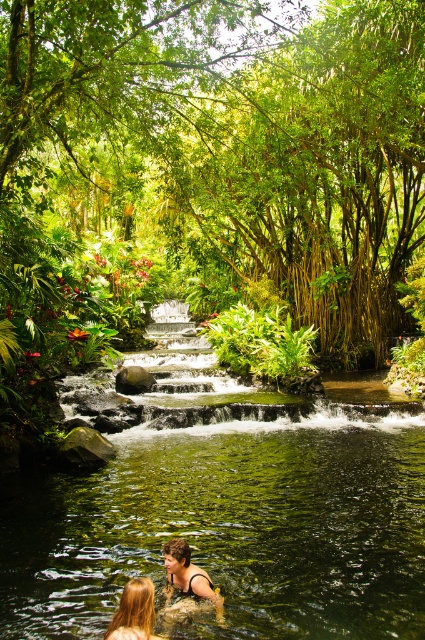
Is green leafy river at center to the right of blonde hair at lower center from the viewer's perspective?

Correct, you'll find green leafy river at center to the right of blonde hair at lower center.

Between green leafy river at center and blonde hair at lower center, which one has less height?

Standing shorter between the two is blonde hair at lower center.

Is point (407, 572) positioned after point (138, 630)?

Yes.

You are a GUI agent. You are given a task and a screenshot of the screen. Output one action in this format:
    pyautogui.click(x=<x>, y=<y>)
    Task: Click on the green leafy river at center
    The image size is (425, 640).
    Given the screenshot: What is the action you would take?
    point(223,509)

Who is taller, green leafy river at center or smooth brown hair at lower center?

Standing taller between the two is green leafy river at center.

Identify the location of green leafy river at center. Image resolution: width=425 pixels, height=640 pixels. (223, 509).

Where is `green leafy river at center`? This screenshot has height=640, width=425. green leafy river at center is located at coordinates (223, 509).

Does blonde hair at lower center appear on the left side of smooth brown hair at lower center?

Correct, you'll find blonde hair at lower center to the left of smooth brown hair at lower center.

You are a GUI agent. You are given a task and a screenshot of the screen. Output one action in this format:
    pyautogui.click(x=<x>, y=<y>)
    Task: Click on the blonde hair at lower center
    
    Given the screenshot: What is the action you would take?
    (133, 612)